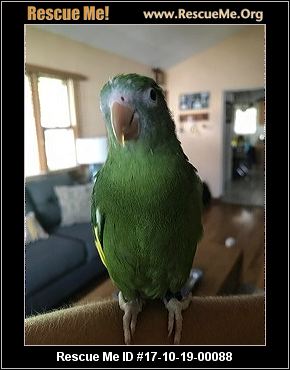
Identify the location of blurred wooden floor. The height and width of the screenshot is (370, 290). (231, 218).